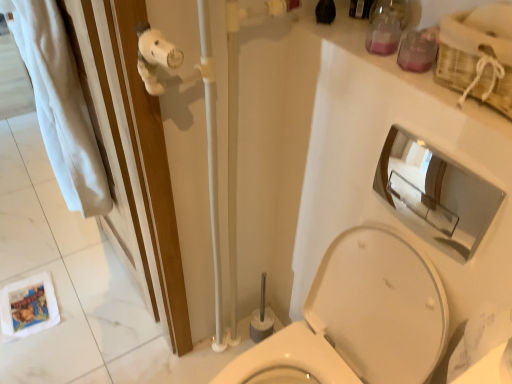
What is the approximate width of translucent plastic container at upper right, acting as the 1th toiletry starting from the front?

It is 2.68 inches.

Describe the element at coordinates (358, 319) in the screenshot. I see `white glossy toilet at center` at that location.

Locate an element on the screen. translucent plastic container at upper right, acting as the first toiletry starting from the bottom is located at coordinates (418, 50).

Is chrome/metallic mirror at upper right far away from pink glass jar at upper right, the 2th toiletry positioned from the front?

No, chrome/metallic mirror at upper right is not far away from pink glass jar at upper right, the 2th toiletry positioned from the front.

From a real-world perspective, is chrome/metallic mirror at upper right positioned above or below pink glass jar at upper right, acting as the 1th toiletry starting from the top?

chrome/metallic mirror at upper right is below pink glass jar at upper right, acting as the 1th toiletry starting from the top.

The height and width of the screenshot is (384, 512). Identify the location of mirror to the right of pink glass jar at upper right, arranged as the first toiletry when viewed from the back. (436, 191).

Choose the correct answer: Is chrome/metallic mirror at upper right inside pink glass jar at upper right, arranged as the first toiletry when viewed from the back, or outside it?

chrome/metallic mirror at upper right exists outside the volume of pink glass jar at upper right, arranged as the first toiletry when viewed from the back.

From the image's perspective, does white plush toy at upper left appear higher than pink glass jar at upper right, placed as the second toiletry when sorted from bottom to top?

Incorrect, from the image's perspective, white plush toy at upper left is lower than pink glass jar at upper right, placed as the second toiletry when sorted from bottom to top.

Would you say white plush toy at upper left contains pink glass jar at upper right, the 2th toiletry positioned from the front?

No.

Which object is more forward, white plush toy at upper left or pink glass jar at upper right, the 2th toiletry positioned from the front?

white plush toy at upper left is closer to the camera.

From a real-world perspective, is pink glass jar at upper right, acting as the 1th toiletry starting from the top, physically located above or below white glossy toilet at center?

pink glass jar at upper right, acting as the 1th toiletry starting from the top, is above white glossy toilet at center.

Considering the sizes of objects pink glass jar at upper right, the 2th toiletry positioned from the front, and white glossy toilet at center in the image provided, who is taller, pink glass jar at upper right, the 2th toiletry positioned from the front, or white glossy toilet at center?

With more height is white glossy toilet at center.

Can you tell me how much pink glass jar at upper right, arranged as the first toiletry when viewed from the back, and white glossy toilet at center differ in facing direction?

The angle between the facing direction of pink glass jar at upper right, arranged as the first toiletry when viewed from the back, and the facing direction of white glossy toilet at center is 2.5 degrees.

From the image's perspective, relative to white glossy toilet at center, is pink glass jar at upper right, acting as the 1th toiletry starting from the top, above or below?

Based on their image positions, pink glass jar at upper right, acting as the 1th toiletry starting from the top, is located above white glossy toilet at center.

Is white glossy toilet at center looking in the opposite direction of chrome/metallic mirror at upper right?

No, white glossy toilet at center's orientation is not away from chrome/metallic mirror at upper right.

Between white glossy toilet at center and chrome/metallic mirror at upper right, which one has smaller size?

Smaller between the two is chrome/metallic mirror at upper right.

Is white glossy toilet at center positioned in front of chrome/metallic mirror at upper right?

Yes, it is.

From a real-world perspective, is white glossy toilet at center on top of chrome/metallic mirror at upper right?

No.

Is point (457, 196) in front of point (409, 34)?

Yes, point (457, 196) is in front of point (409, 34).

Based on the photo, what's the angular difference between chrome/metallic mirror at upper right and translucent plastic container at upper right, acting as the first toiletry starting from the bottom,'s facing directions?

The facing directions of chrome/metallic mirror at upper right and translucent plastic container at upper right, acting as the first toiletry starting from the bottom, are 1.41 degrees apart.

Based on the photo, can you confirm if chrome/metallic mirror at upper right is bigger than translucent plastic container at upper right, acting as the first toiletry starting from the bottom?

Indeed, chrome/metallic mirror at upper right has a larger size compared to translucent plastic container at upper right, acting as the first toiletry starting from the bottom.

Between chrome/metallic mirror at upper right and translucent plastic container at upper right, which is the 2th toiletry from back to front, which one has larger width?

translucent plastic container at upper right, which is the 2th toiletry from back to front.

Can you confirm if pink glass jar at upper right, arranged as the first toiletry when viewed from the back, is positioned to the right of chrome/metallic mirror at upper right?

Incorrect, pink glass jar at upper right, arranged as the first toiletry when viewed from the back, is not on the right side of chrome/metallic mirror at upper right.

From a real-world perspective, which object stands above the other?

In real-world perspective, pink glass jar at upper right, acting as the 1th toiletry starting from the top, is above.

Which object is thinner, pink glass jar at upper right, placed as the second toiletry when sorted from bottom to top, or chrome/metallic mirror at upper right?

chrome/metallic mirror at upper right.

Is pink glass jar at upper right, arranged as the first toiletry when viewed from the back, not inside chrome/metallic mirror at upper right?

pink glass jar at upper right, arranged as the first toiletry when viewed from the back, lies outside chrome/metallic mirror at upper right's area.

How different are the orientations of white glossy toilet at center and translucent plastic container at upper right, which is the 2th toiletry from back to front, in degrees?

The angle between the facing direction of white glossy toilet at center and the facing direction of translucent plastic container at upper right, which is the 2th toiletry from back to front, is 2.5 degrees.

Is white glossy toilet at center spatially inside translucent plastic container at upper right, which is the 2th toiletry from back to front, or outside of it?

white glossy toilet at center is not inside translucent plastic container at upper right, which is the 2th toiletry from back to front, it's outside.

From the image's perspective, which is below, white glossy toilet at center or translucent plastic container at upper right, acting as the 1th toiletry starting from the front?

From the image's view, white glossy toilet at center is below.

The width and height of the screenshot is (512, 384). I want to click on toilet below the translucent plastic container at upper right, which is the 2th toiletry from back to front (from the image's perspective), so click(358, 319).

Find the location of a particular element. This screenshot has height=384, width=512. mirror below the pink glass jar at upper right, arranged as the first toiletry when viewed from the back (from the image's perspective) is located at coordinates (436, 191).

Where is `the 1st toiletry to the right of the white plush toy at upper left, counting from the anchor's position`? The image size is (512, 384). the 1st toiletry to the right of the white plush toy at upper left, counting from the anchor's position is located at coordinates (385, 27).

Which object lies further to the anchor point white glossy toilet at center, translucent plastic container at upper right, acting as the first toiletry starting from the bottom, or chrome/metallic mirror at upper right?

Among the two, translucent plastic container at upper right, acting as the first toiletry starting from the bottom, is located further to white glossy toilet at center.

From the image, which object appears to be farther from translucent plastic container at upper right, the second toiletry in the top-to-bottom sequence, chrome/metallic mirror at upper right or white plush toy at upper left?

white plush toy at upper left is positioned further to the anchor translucent plastic container at upper right, the second toiletry in the top-to-bottom sequence.

Consider the image. Which object lies nearer to the anchor point white glossy toilet at center, translucent plastic container at upper right, which is the 2th toiletry from back to front, or white plush toy at upper left?

white plush toy at upper left lies closer to white glossy toilet at center than the other object.

Estimate the real-world distances between objects in this image. Which object is closer to white plush toy at upper left, translucent plastic container at upper right, which is the 2th toiletry from back to front, or white glossy toilet at center?

white glossy toilet at center is positioned closer to the anchor white plush toy at upper left.

Looking at the image, which one is located closer to pink glass jar at upper right, placed as the second toiletry when sorted from bottom to top, white glossy toilet at center or translucent plastic container at upper right, acting as the 1th toiletry starting from the front?

Among the two, translucent plastic container at upper right, acting as the 1th toiletry starting from the front, is located nearer to pink glass jar at upper right, placed as the second toiletry when sorted from bottom to top.

Looking at the image, which one is located closer to white plush toy at upper left, chrome/metallic mirror at upper right or translucent plastic container at upper right, which is the 2th toiletry from back to front?

Among the two, chrome/metallic mirror at upper right is located nearer to white plush toy at upper left.

Estimate the real-world distances between objects in this image. Which object is further from translucent plastic container at upper right, acting as the 1th toiletry starting from the front, white plush toy at upper left or pink glass jar at upper right, the 2th toiletry positioned from the front?

white plush toy at upper left lies further to translucent plastic container at upper right, acting as the 1th toiletry starting from the front, than the other object.

Based on their spatial positions, is pink glass jar at upper right, placed as the second toiletry when sorted from bottom to top, or white plush toy at upper left further from white glossy toilet at center?

Based on the image, pink glass jar at upper right, placed as the second toiletry when sorted from bottom to top, appears to be further to white glossy toilet at center.

At what (x,y) coordinates should I click in order to perform the action: click on toiletry that lies between pink glass jar at upper right, placed as the second toiletry when sorted from bottom to top, and white glossy toilet at center from top to bottom. Please return your answer as a coordinate pair (x, y). The width and height of the screenshot is (512, 384). Looking at the image, I should click on (418, 50).

You are a GUI agent. You are given a task and a screenshot of the screen. Output one action in this format:
    pyautogui.click(x=<x>, y=<y>)
    Task: Click on the mirror that lies between pink glass jar at upper right, the 2th toiletry positioned from the front, and white glossy toilet at center from top to bottom
    This screenshot has height=384, width=512.
    Given the screenshot: What is the action you would take?
    pyautogui.click(x=436, y=191)

Identify the location of toiletry between pink glass jar at upper right, arranged as the first toiletry when viewed from the back, and white plush toy at upper left vertically. (418, 50).

Where is `mirror between pink glass jar at upper right, the 2th toiletry positioned from the front, and white plush toy at upper left in the up-down direction`? The height and width of the screenshot is (384, 512). mirror between pink glass jar at upper right, the 2th toiletry positioned from the front, and white plush toy at upper left in the up-down direction is located at coordinates (436, 191).